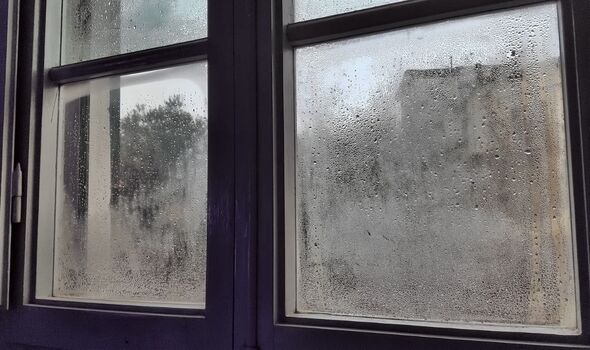
At what (x,y) coordinates should I click in order to perform the action: click on top left window. Please return your answer as a coordinate pair (x, y). Looking at the image, I should click on (91, 23).